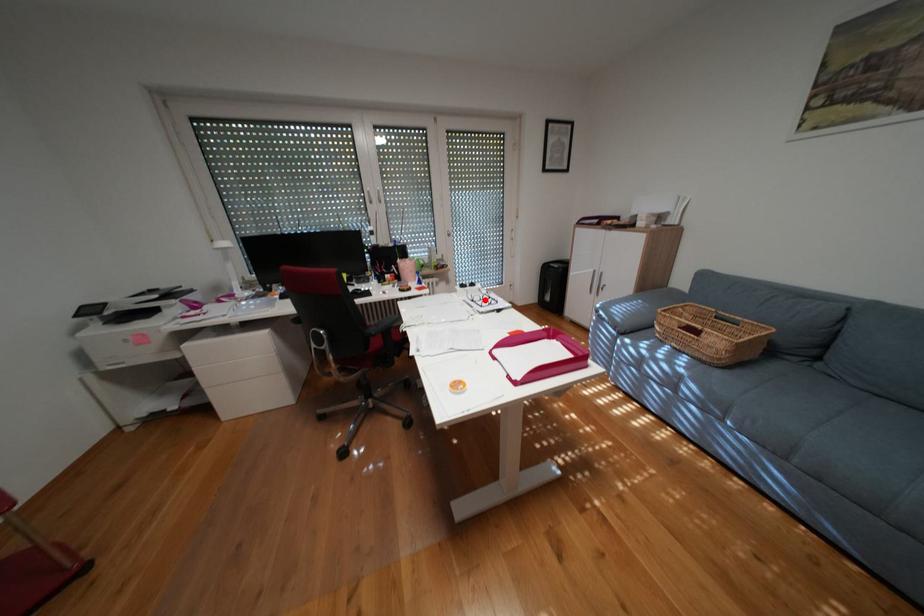
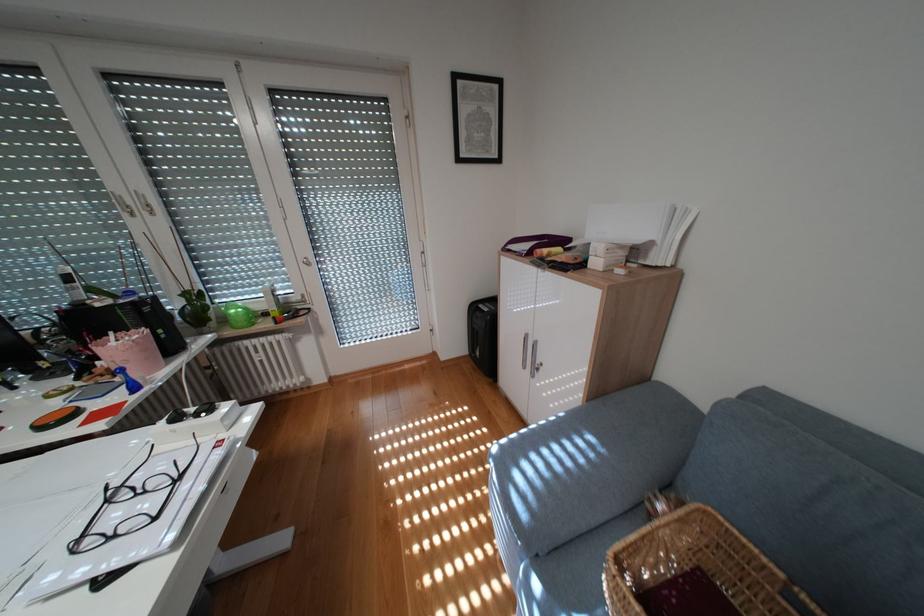
In the second image, find the point that corresponds to the highlighted location in the first image.

(119, 501)